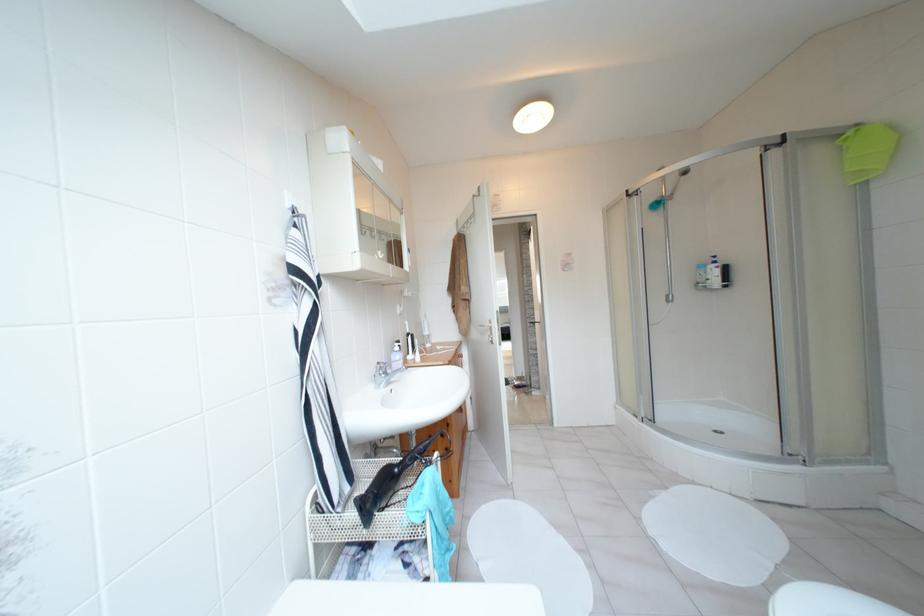
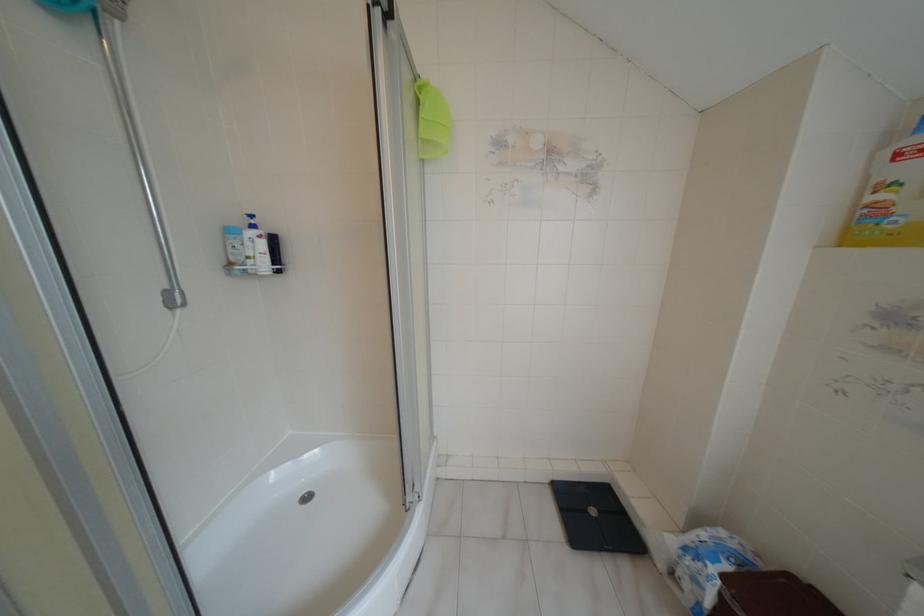
Find the pixel in the second image that matches (724,286) in the first image.

(277, 270)